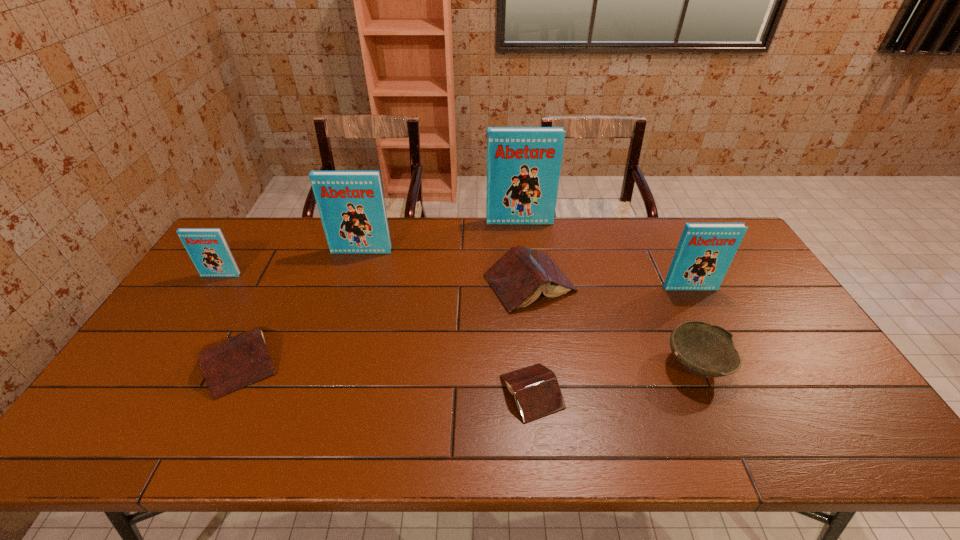
Locate an element on the screen. bowl is located at coordinates 706,350.

Locate an element on the screen. This screenshot has width=960, height=540. the second biggest brown book is located at coordinates (232, 363).

This screenshot has width=960, height=540. I want to click on the second shortest object, so click(x=232, y=363).

Locate an element on the screen. the shortest book is located at coordinates (537, 393).

Identify the location of the smallest brown book. (537, 393).

I want to click on free region located on the front cover of the tallest object, so click(528, 291).

You are a GUI agent. You are given a task and a screenshot of the screen. Output one action in this format:
    pyautogui.click(x=<x>, y=<y>)
    Task: Click on the vacant space located on the front cover of the second tallest book
    
    Given the screenshot: What is the action you would take?
    pyautogui.click(x=339, y=322)

The width and height of the screenshot is (960, 540). In order to click on vacant area located on the front cover of the rightmost blue book in this screenshot , I will do `click(727, 359)`.

Where is `vacant space located on the front cover of the smallest blue book`? vacant space located on the front cover of the smallest blue book is located at coordinates (204, 302).

Identify the location of vacant space located on the left of the biggest brown book. (404, 284).